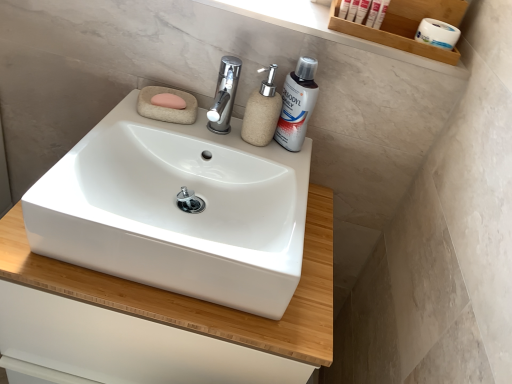
Identify the location of chrome metallic tap at center. The width and height of the screenshot is (512, 384). (224, 95).

The height and width of the screenshot is (384, 512). What do you see at coordinates (177, 210) in the screenshot?
I see `white ceramic sink at center` at bounding box center [177, 210].

You are a GUI agent. You are given a task and a screenshot of the screen. Output one action in this format:
    pyautogui.click(x=<x>, y=<y>)
    Task: Click on the white matte cabinet at center
    The width and height of the screenshot is (512, 384).
    Given the screenshot: What is the action you would take?
    pyautogui.click(x=195, y=299)

What do you see at coordinates (262, 112) in the screenshot? I see `beige textured soap dispenser at center` at bounding box center [262, 112].

This screenshot has height=384, width=512. Describe the element at coordinates (381, 14) in the screenshot. I see `white matte tube at upper right` at that location.

Describe the element at coordinates (437, 33) in the screenshot. I see `white matte toilet paper at upper right` at that location.

Find the location of a particular element. The image size is (512, 384). white plastic tube at upper right is located at coordinates (352, 10).

Is white matte toilet paper at upper right in contact with beige textured soap dispenser at center?

white matte toilet paper at upper right is not next to beige textured soap dispenser at center, and they're not touching.

Between point (454, 41) and point (275, 129), which one is positioned behind?

Point (275, 129)

Find the location of `toilet paper on the right of beige textured soap dispenser at center`. toilet paper on the right of beige textured soap dispenser at center is located at coordinates (437, 33).

Does white matte toilet paper at upper right come in front of beige textured soap dispenser at center?

No.

Is white matte toilet paper at upper right positioned before white matte tube at upper right?

That is True.

In the scene shown: Can we say white matte toilet paper at upper right lies outside white matte tube at upper right?

white matte toilet paper at upper right lies outside white matte tube at upper right's area.

Where is `cosmetic on the left of the white matte toilet paper at upper right`? cosmetic on the left of the white matte toilet paper at upper right is located at coordinates (381, 14).

From the image's perspective, which one is positioned higher, white ceramic sink at center or white matte tube at upper right?

white matte tube at upper right, from the image's perspective.

Is white ceramic sink at center not close to white matte tube at upper right?

white ceramic sink at center is near white matte tube at upper right, not far away.

Which of these two, white ceramic sink at center or white matte tube at upper right, is wider?

Wider between the two is white ceramic sink at center.

Is white ceramic sink at center spatially inside white matte tube at upper right, or outside of it?

white ceramic sink at center is spatially situated outside white matte tube at upper right.

Consider the image. Can you tell me how much pink rubber soap at upper left and white plastic tubes at upper right, marked as the 2th personal care in a right-to-left arrangement, differ in facing direction?

The angular difference between pink rubber soap at upper left and white plastic tubes at upper right, marked as the 2th personal care in a right-to-left arrangement, is 4.25 degrees.

Locate an element on the screen. the 1st personal care positioned above the pink rubber soap at upper left (from a real-world perspective) is located at coordinates (362, 11).

In the scene shown: Considering the relative sizes of pink rubber soap at upper left and white plastic tubes at upper right, marked as the 2th personal care in a right-to-left arrangement, in the image provided, is pink rubber soap at upper left bigger than white plastic tubes at upper right, marked as the 2th personal care in a right-to-left arrangement,?

Correct, pink rubber soap at upper left is larger in size than white plastic tubes at upper right, marked as the 2th personal care in a right-to-left arrangement.

In the scene shown: Can we say pink rubber soap at upper left lies outside white plastic tubes at upper right, marked as the 2th personal care in a right-to-left arrangement?

Absolutely, pink rubber soap at upper left is external to white plastic tubes at upper right, marked as the 2th personal care in a right-to-left arrangement.

Considering the sizes of objects white plastic tube at upper right and pink rubber soap at upper left in the image provided, who is thinner, white plastic tube at upper right or pink rubber soap at upper left?

With smaller width is white plastic tube at upper right.

Which is more to the right, white plastic tube at upper right or pink rubber soap at upper left?

white plastic tube at upper right is more to the right.

Which object is further away from the camera taking this photo, white plastic tube at upper right or pink rubber soap at upper left?

white plastic tube at upper right is further away from the camera.

Which of these two, white plastic tube at upper right or pink rubber soap at upper left, stands taller?

With more height is white plastic tube at upper right.

Is white plastic tube at upper right shorter than white plastic toothpaste at upper right, marked as the 2th personal care in a left-to-right arrangement?

Incorrect, the height of white plastic tube at upper right does not fall short of that of white plastic toothpaste at upper right, marked as the 2th personal care in a left-to-right arrangement.

From the image's perspective, who appears lower, white plastic tube at upper right or white plastic toothpaste at upper right, the first personal care from the right?

From the image's view, white plastic toothpaste at upper right, the first personal care from the right, is below.

Is point (359, 1) positioned behind point (379, 0)?

Yes, it is behind point (379, 0).

From the picture: Considering the relative sizes of beige textured soap dispenser at center and pink rubber soap at upper left in the image provided, is beige textured soap dispenser at center shorter than pink rubber soap at upper left?

No, beige textured soap dispenser at center is not shorter than pink rubber soap at upper left.

Is beige textured soap dispenser at center turned away from pink rubber soap at upper left?

That's not correct — beige textured soap dispenser at center is not looking away from pink rubber soap at upper left.

From the image's perspective, is beige textured soap dispenser at center above or below pink rubber soap at upper left?

From the image's perspective, beige textured soap dispenser at center appears below pink rubber soap at upper left.

Which is in front, beige textured soap dispenser at center or pink rubber soap at upper left?

beige textured soap dispenser at center is closer to the camera.

Find the location of a particular element. soap dispenser below the white matte toilet paper at upper right (from the image's perspective) is located at coordinates click(x=262, y=112).

At what (x,y) coordinates should I click in order to perform the action: click on cosmetic lying above the white matte toilet paper at upper right (from the image's perspective). Please return your answer as a coordinate pair (x, y). Looking at the image, I should click on (381, 14).

From the image, which object appears to be nearer to white glossy shaving cream at upper right, beige textured soap dispenser at center or white ceramic sink at center?

beige textured soap dispenser at center is closer to white glossy shaving cream at upper right.

From the picture: Considering their positions, is white matte toilet paper at upper right positioned closer to white matte tube at upper right than white plastic tube at upper right?

white plastic tube at upper right is closer to white matte tube at upper right.

Based on their spatial positions, is beige textured soap dispenser at center or wooden shelf at upper right further from white plastic tubes at upper right, marked as the 2th personal care in a right-to-left arrangement?

beige textured soap dispenser at center.

In the scene shown: When comparing their distances from white ceramic sink at center, does white plastic toothpaste at upper right, the first personal care from the right, or white glossy shaving cream at upper right seem further?

The object further to white ceramic sink at center is white plastic toothpaste at upper right, the first personal care from the right.

Based on their spatial positions, is pink rubber soap at upper left or white plastic tubes at upper right, marked as the 2th personal care in a right-to-left arrangement, further from white matte toilet paper at upper right?

pink rubber soap at upper left lies further to white matte toilet paper at upper right than the other object.

Based on their spatial positions, is white glossy shaving cream at upper right or white plastic toothpaste at upper right, marked as the 2th personal care in a left-to-right arrangement, closer to white plastic tube at upper right?

Based on the image, white plastic toothpaste at upper right, marked as the 2th personal care in a left-to-right arrangement, appears to be nearer to white plastic tube at upper right.

Estimate the real-world distances between objects in this image. Which object is closer to pink rubber soap at upper left, chrome metallic tap at center or wooden shelf at upper right?

Among the two, chrome metallic tap at center is located nearer to pink rubber soap at upper left.

When comparing their distances from white matte tube at upper right, does white glossy shaving cream at upper right or white matte toilet paper at upper right seem closer?

Based on the image, white matte toilet paper at upper right appears to be nearer to white matte tube at upper right.

Locate an element on the screen. This screenshot has width=512, height=384. cosmetic situated between beige textured soap dispenser at center and white matte toilet paper at upper right from left to right is located at coordinates (381, 14).

Where is `tap situated between pink rubber soap at upper left and white glossy shaving cream at upper right from left to right`? tap situated between pink rubber soap at upper left and white glossy shaving cream at upper right from left to right is located at coordinates (224, 95).

Identify the location of shelf between white plastic tube at upper right and white glossy shaving cream at upper right in the vertical direction. (406, 26).

You are a GUI agent. You are given a task and a screenshot of the screen. Output one action in this format:
    pyautogui.click(x=<x>, y=<y>)
    Task: Click on the soap dispenser between pink rubber soap at upper left and white plastic tube at upper right from left to right
    The height and width of the screenshot is (384, 512).
    Given the screenshot: What is the action you would take?
    coord(262,112)